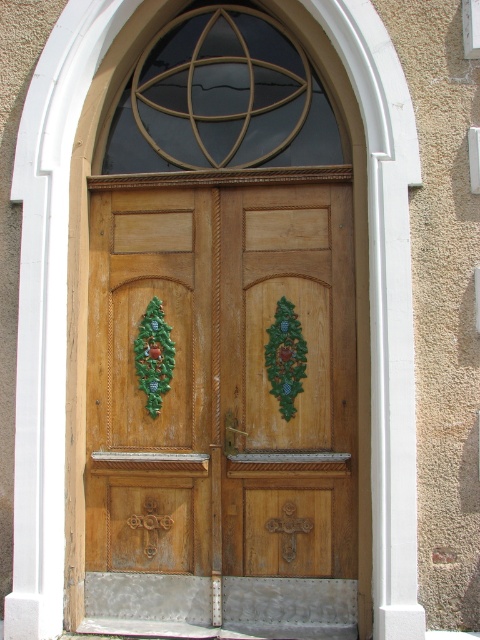
Question: Where is wooden door at center located in relation to green carved wreath at center in the image?

Choices:
 (A) above
 (B) below

Answer: (B)

Question: Among these points, which one is farthest from the camera?

Choices:
 (A) (166, 333)
 (B) (112, 212)

Answer: (B)

Question: Can you confirm if wooden door at center is positioned to the right of green textured wreath at center?

Choices:
 (A) no
 (B) yes

Answer: (A)

Question: Which of these objects is positioned farthest from the wooden door at center?

Choices:
 (A) green textured wreath at center
 (B) green carved wreath at center

Answer: (B)

Question: Is wooden door at center further to the viewer compared to green carved wreath at center?

Choices:
 (A) no
 (B) yes

Answer: (A)

Question: Among these objects, which one is farthest from the camera?

Choices:
 (A) green carved wreath at center
 (B) wooden door at center
 (C) green textured wreath at center

Answer: (A)